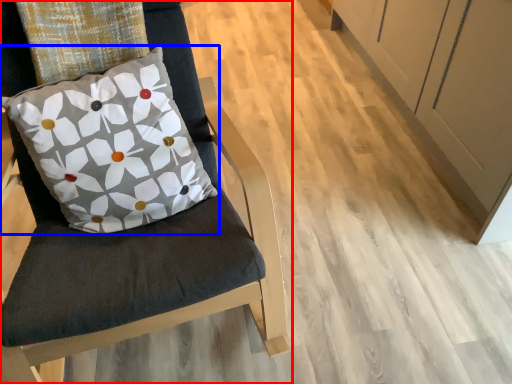
Question: Which object is further to the camera taking this photo, chair (highlighted by a red box) or pillow (highlighted by a blue box)?

Choices:
 (A) chair
 (B) pillow

Answer: (B)